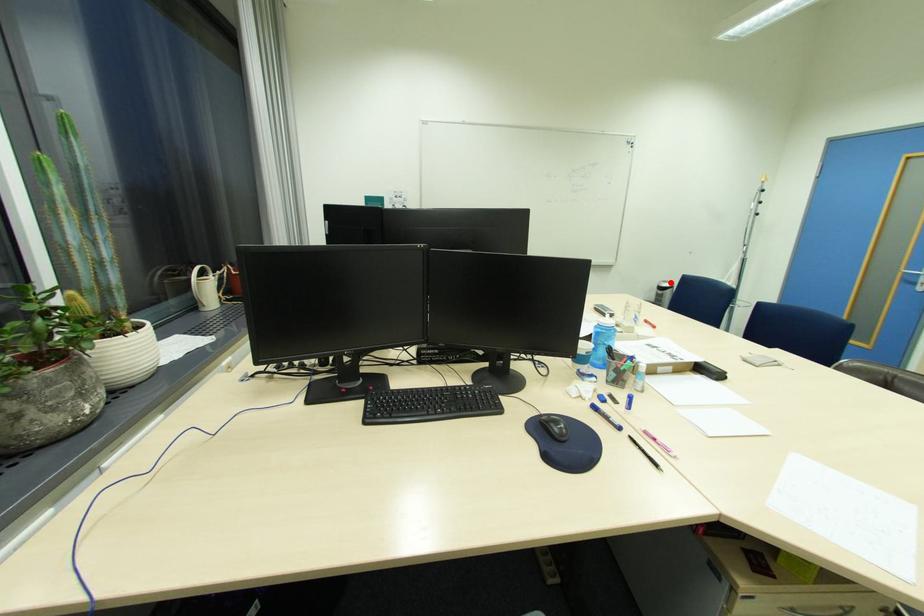
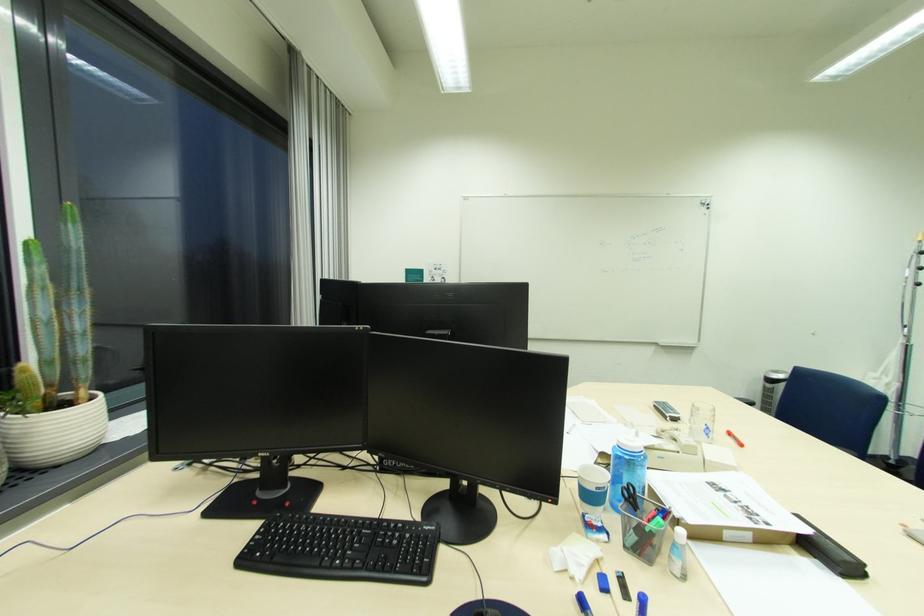
Question: I am providing you with two images of the same scene from different viewpoints. In image1, a red point is highlighted. Considering the same 3D point in image2, which of the following is correct?

Choices:
 (A) It is closer
 (B) It is farther

Answer: (B)